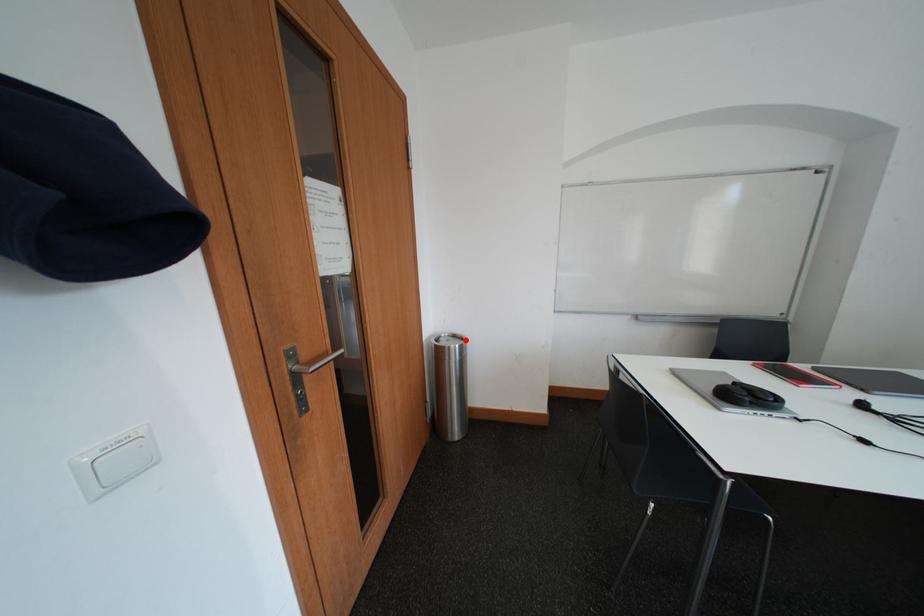
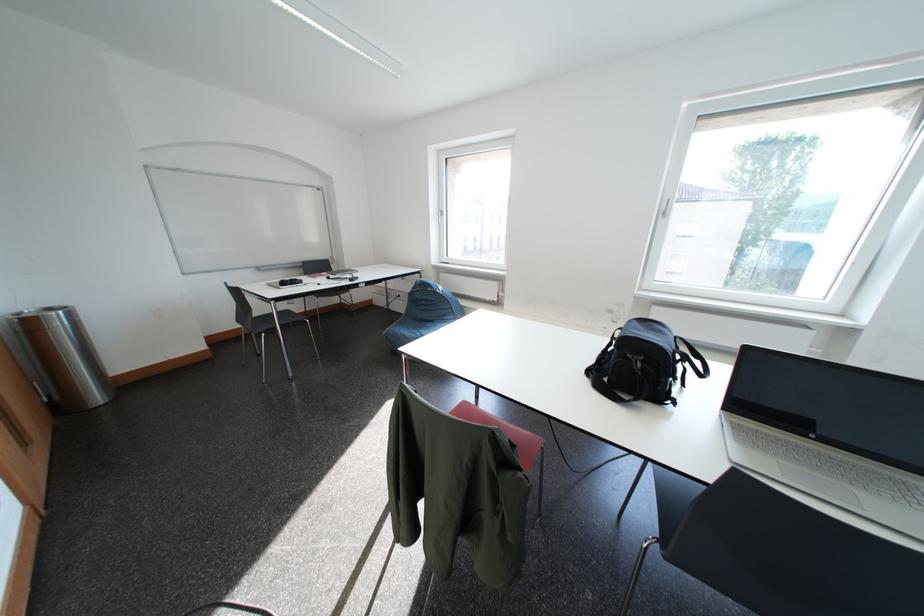
Question: A red point is marked in image1. In image2, is the corresponding 3D point closer to the camera or farther? Reply with the corresponding letter.

Choices:
 (A) The corresponding 3D point is closer.
 (B) The corresponding 3D point is farther.

Answer: (B)